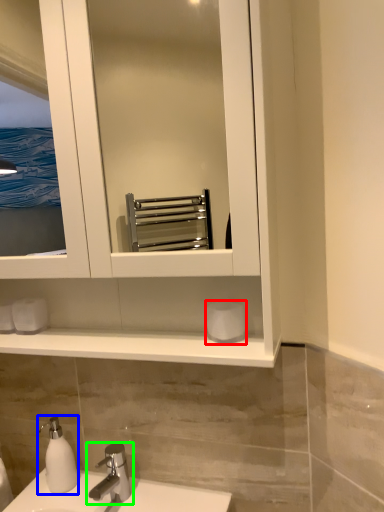
Question: Which is farther away from toilet paper (highlighted by a red box)? soap dispenser (highlighted by a blue box) or tap (highlighted by a green box)?

Choices:
 (A) soap dispenser
 (B) tap

Answer: (A)